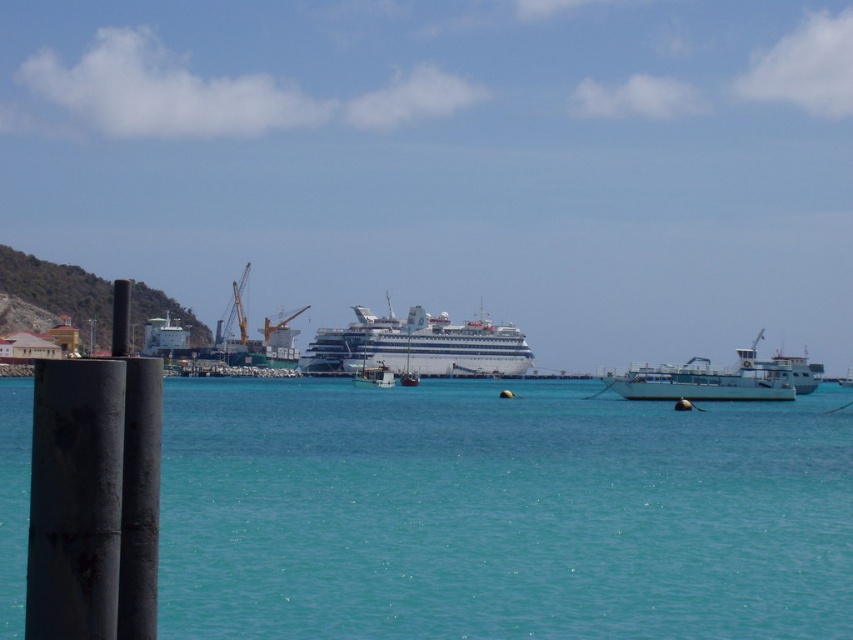
Question: Which object appears closest to the camera in this image?

Choices:
 (A) clear blue water at center
 (B) white glossy cruise ship at center

Answer: (A)

Question: Is clear blue water at center positioned in front of white matte boat at right?

Choices:
 (A) no
 (B) yes

Answer: (B)

Question: Can you confirm if clear blue water at center is wider than white glossy cruise ship at center?

Choices:
 (A) yes
 (B) no

Answer: (A)

Question: Which point is farther from the camera taking this photo?

Choices:
 (A) (326, 452)
 (B) (332, 340)
 (C) (706, 397)

Answer: (B)

Question: Can you confirm if white glossy cruise ship at center is positioned to the right of white matte boat at right?

Choices:
 (A) yes
 (B) no

Answer: (B)

Question: Which object appears closest to the camera in this image?

Choices:
 (A) clear blue water at center
 (B) white matte boat at right

Answer: (A)